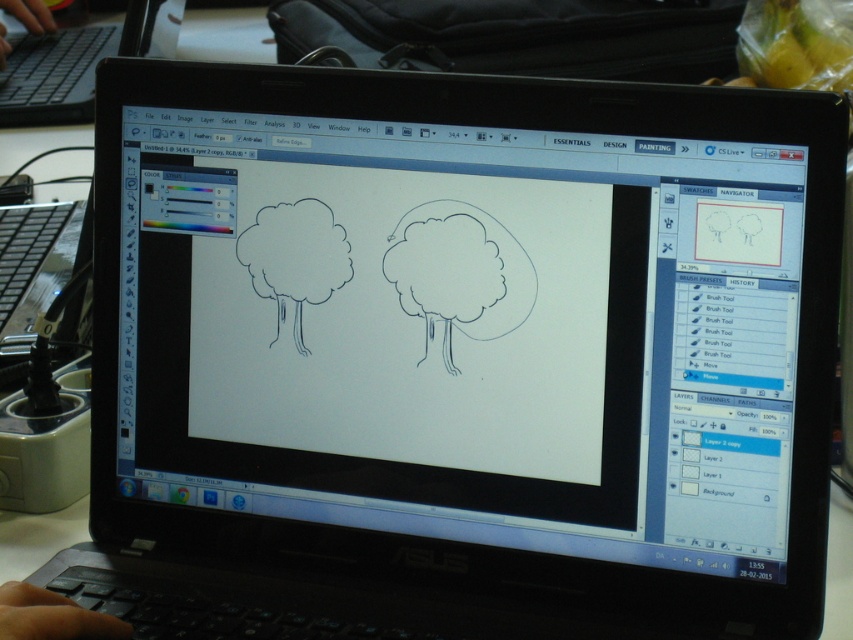
Question: Does skinny finger at lower left appear under black plastic keyboard at upper left?

Choices:
 (A) no
 (B) yes

Answer: (B)

Question: Does black plastic laptop at upper left have a larger size compared to skinny finger at lower left?

Choices:
 (A) no
 (B) yes

Answer: (B)

Question: Is black plastic laptop at upper left above skinny finger at lower left?

Choices:
 (A) yes
 (B) no

Answer: (A)

Question: Which is farther from the skinny finger at lower left?

Choices:
 (A) black plastic keyboard at upper left
 (B) black plastic laptop at upper left

Answer: (A)

Question: Which point is closer to the camera taking this photo?

Choices:
 (A) (3, 45)
 (B) (68, 620)
 (C) (86, 108)

Answer: (B)

Question: Among these objects, which one is nearest to the camera?

Choices:
 (A) black plastic laptop at upper left
 (B) skinny finger at lower left
 (C) black plastic keyboard at upper left

Answer: (B)